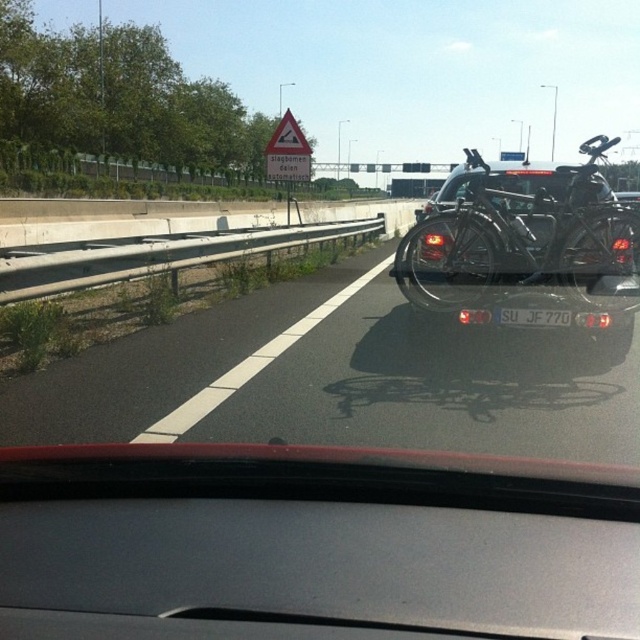
Which is more to the left, shiny metallic bicycle at right or white plastic license plate at center?

Positioned to the left is white plastic license plate at center.

Measure the distance from shiny metallic bicycle at right to white plastic license plate at center.

shiny metallic bicycle at right is 1.67 meters away from white plastic license plate at center.

Does point (506, 252) lie behind point (548, 308)?

Yes, point (506, 252) is behind point (548, 308).

Identify the location of shiny metallic bicycle at right. (518, 234).

Who is more forward, (x=301, y=176) or (x=540, y=324)?

Point (x=540, y=324) is in front.

Who is positioned more to the left, yellow plastic triangle at upper center or white plastic license plate at center?

From the viewer's perspective, yellow plastic triangle at upper center appears more on the left side.

Is point (305, 176) more distant than point (564, 316)?

Yes.

The image size is (640, 640). What are the coordinates of `yellow plastic triangle at upper center` in the screenshot? It's located at (288, 152).

Does point (538, 456) come behind point (276, 124)?

No, (538, 456) is closer to viewer.

Is black asphalt road at center positioned before yellow plastic triangle at upper center?

Yes.

Is point (321, 339) in front of point (305, 148)?

Yes.

The height and width of the screenshot is (640, 640). Find the location of `black asphalt road at center`. black asphalt road at center is located at coordinates (333, 380).